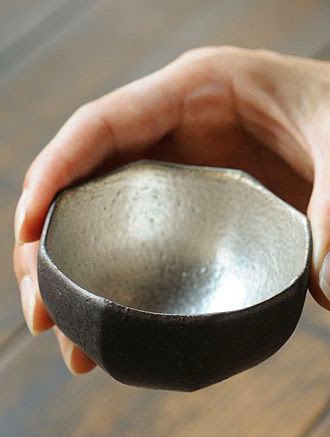
Image resolution: width=330 pixels, height=437 pixels. What are the coordinates of `inside of steel cup` in the screenshot? It's located at (161, 268).